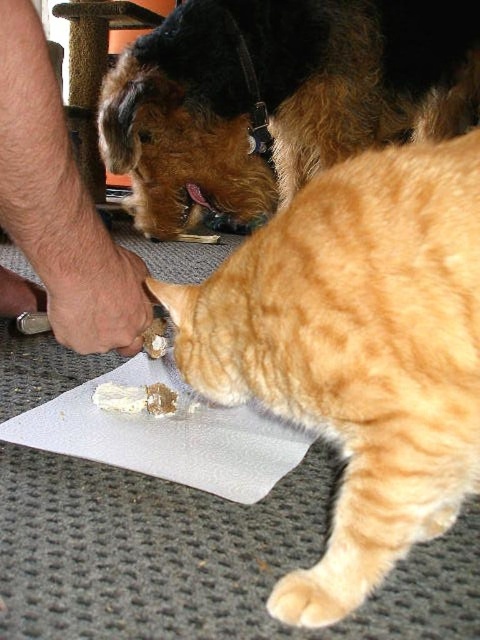
Looking at this image, you are a photographer trying to capture a clear shot of the white creamy food at center while the orange fur cat at lower right is eating. Will the cat block the view of the food in the photo?

The orange fur cat at lower right is in front of the white creamy food at center, so the cat will block the view of the food in the photo.

You are a photographer trying to focus on the two points in the image. Which point is nearer to you, point (287,273) or point (122,400)?

Point (287,273) is closer to the viewer than point (122,400).

You are a photographer trying to capture the brown fur dog at upper center in the image. The camera you are using has a focus point at coordinate point (278, 99). Will the focus point successfully capture the brown fur dog at upper center?

Yes, the focus point at coordinate point (278, 99) is exactly where the brown fur dog at upper center is located, so it will successfully capture the brown fur dog at upper center.